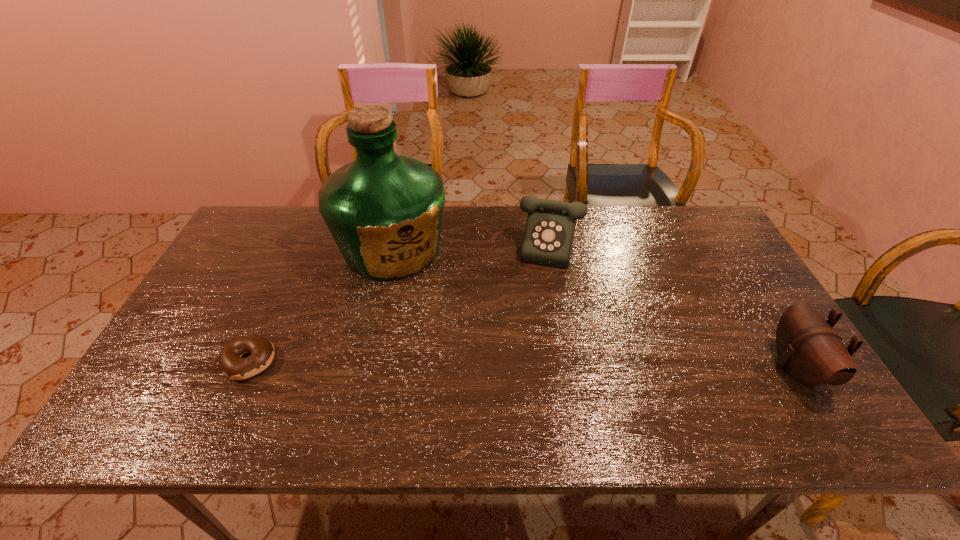
Locate an element on the screen. This screenshot has height=540, width=960. object at the left edge is located at coordinates (231, 363).

What are the coordinates of `object that is at the right edge` in the screenshot? It's located at (811, 352).

The width and height of the screenshot is (960, 540). I want to click on object that is at the near left corner, so click(x=231, y=363).

Where is `object at the near right corner`? This screenshot has height=540, width=960. object at the near right corner is located at coordinates (811, 352).

Locate an element on the screen. free space at the far edge of the desktop is located at coordinates (525, 215).

I want to click on blank space at the left edge of the desktop, so click(x=237, y=300).

Where is `vacant space at the far right corner of the desktop`? The width and height of the screenshot is (960, 540). vacant space at the far right corner of the desktop is located at coordinates (664, 219).

This screenshot has height=540, width=960. In order to click on empty space between the third object from left to right and the rightmost object in this screenshot , I will do `click(681, 308)`.

What are the coordinates of `unoccupied position between the telephone and the second object from left to right` in the screenshot? It's located at (479, 248).

You are a GUI agent. You are given a task and a screenshot of the screen. Output one action in this format:
    pyautogui.click(x=<x>, y=<y>)
    Task: Click on the free point between the second object from right to left and the leftmost object
    The height and width of the screenshot is (540, 960).
    Given the screenshot: What is the action you would take?
    pyautogui.click(x=408, y=305)